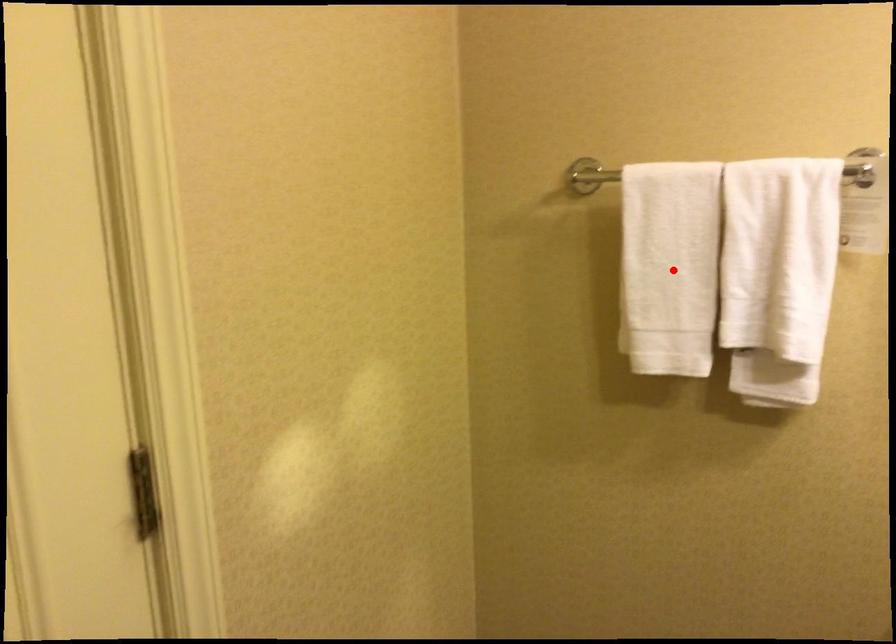
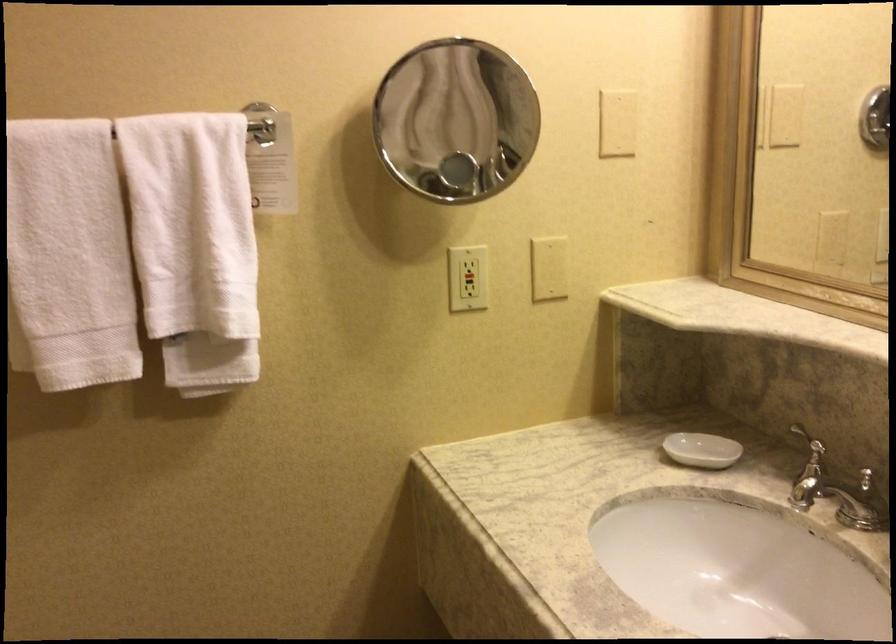
Question: I am providing you with two images of the same scene from different viewpoints. Given a red point in image1, look at the same physical point in image2. Is it:

Choices:
 (A) Closer to the viewpoint
 (B) Farther from the viewpoint

Answer: (A)